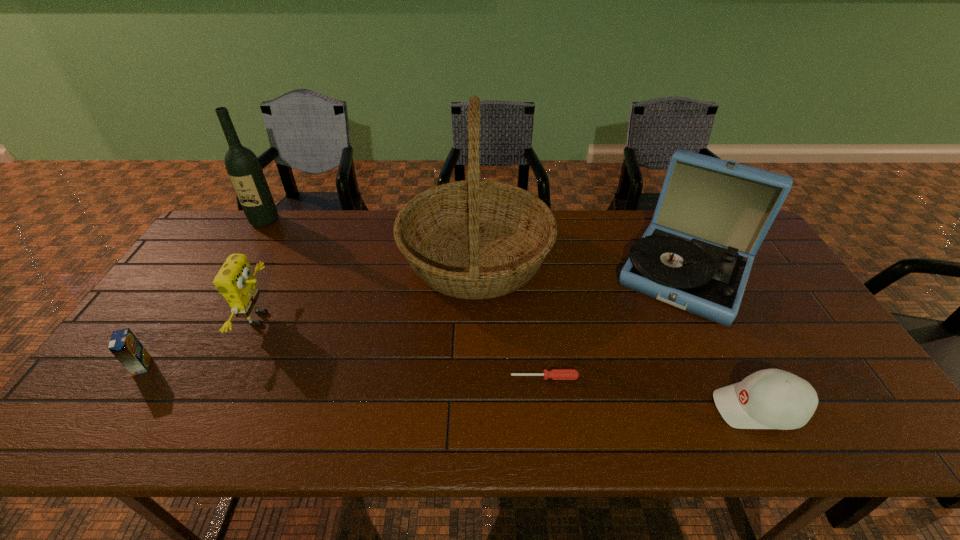
At what (x,y) coordinates should I click in order to perform the action: click on vacant point located between the fourth tallest object and the basket. Please return your answer as a coordinate pair (x, y). This screenshot has height=540, width=960. Looking at the image, I should click on (369, 289).

This screenshot has width=960, height=540. In order to click on free point between the orange_juice and the third object from left to right in this screenshot , I will do `click(201, 342)`.

Point out which object is positioned as the fourth nearest to the screwdriver. Please provide its 2D coordinates. Your answer should be formatted as a tuple, i.e. [(x, y)], where the tuple contains the x and y coordinates of a point satisfying the conditions above.

[(235, 281)]

Select which object appears as the second closest to the baseball cap. Please provide its 2D coordinates. Your answer should be formatted as a tuple, i.e. [(x, y)], where the tuple contains the x and y coordinates of a point satisfying the conditions above.

[(556, 374)]

Where is `vacant region that satisfies the following two spatial constraints: 1. on the face of the screwdriver; 2. on the right side of the sponge`? vacant region that satisfies the following two spatial constraints: 1. on the face of the screwdriver; 2. on the right side of the sponge is located at coordinates (232, 377).